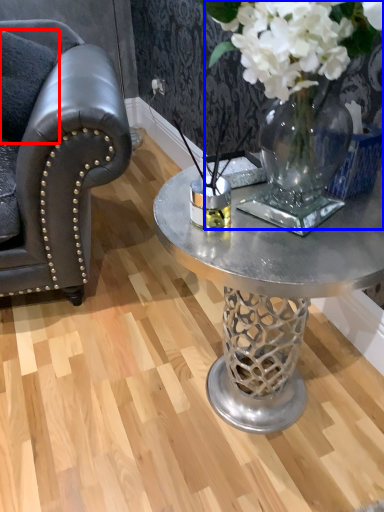
Question: Which point is closer to the camera, dark (highlighted by a red box) or floral arrangement (highlighted by a blue box)?

Choices:
 (A) dark
 (B) floral arrangement

Answer: (B)